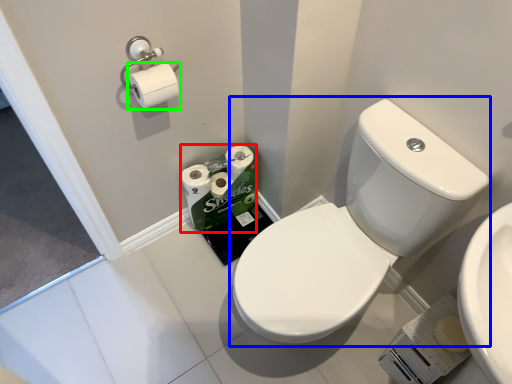
Question: Which is farther away from toilet paper (highlighted by a red box)? sink (highlighted by a blue box) or toilet paper (highlighted by a green box)?

Choices:
 (A) sink
 (B) toilet paper

Answer: (A)